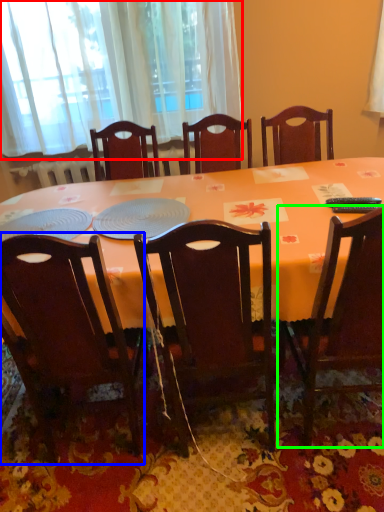
Question: Which object is the closest to the window screen (highlighted by a red box)? Choose among these: chair (highlighted by a blue box) or chair (highlighted by a green box).

Choices:
 (A) chair
 (B) chair

Answer: (A)